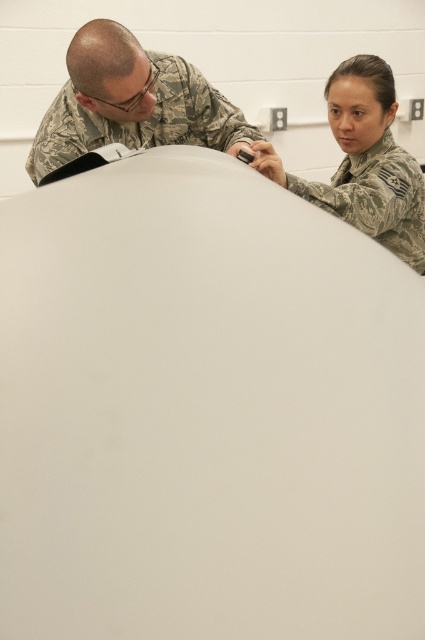
Does camouflage uniform at upper left appear on the right side of camouflage uniform at upper right?

No, camouflage uniform at upper left is not to the right of camouflage uniform at upper right.

Describe the element at coordinates (130, 102) in the screenshot. Image resolution: width=425 pixels, height=640 pixels. I see `camouflage uniform at upper left` at that location.

The width and height of the screenshot is (425, 640). Identify the location of camouflage uniform at upper left. (130, 102).